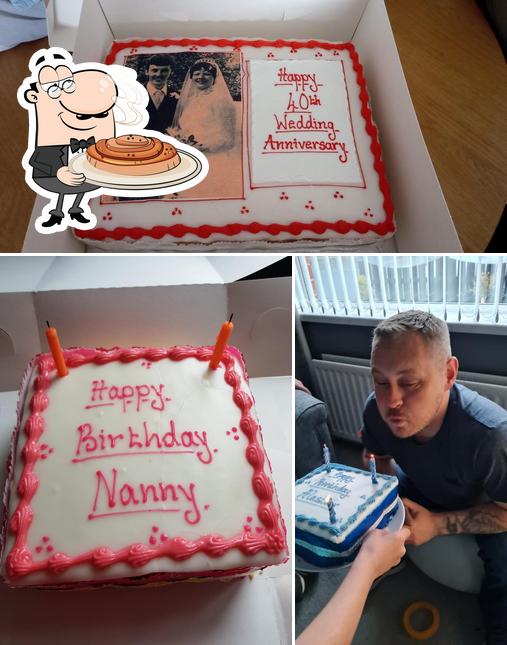
At what (x,y) coordinates should I click in order to perform the action: click on hand grasping dinner plate. Please return your answer as a coordinate pair (x, y). Looking at the image, I should click on (392, 544).